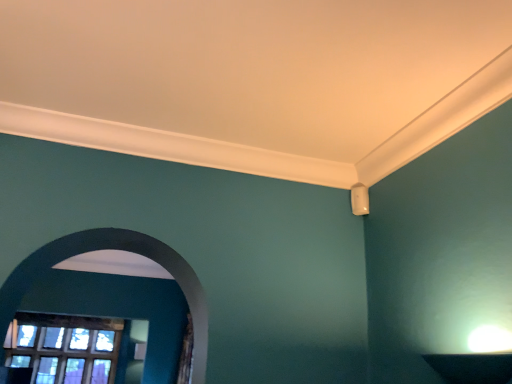
You are a GUI agent. You are given a task and a screenshot of the screen. Output one action in this format:
    pyautogui.click(x=<x>, y=<y>)
    Task: Click on the clear glass window at lower left
    This screenshot has height=384, width=512.
    Given the screenshot: What is the action you would take?
    pyautogui.click(x=65, y=348)

What do you see at coordinates (65, 348) in the screenshot? I see `clear glass window at lower left` at bounding box center [65, 348].

Locate an element on the screen. The image size is (512, 384). clear glass window at lower left is located at coordinates (65, 348).